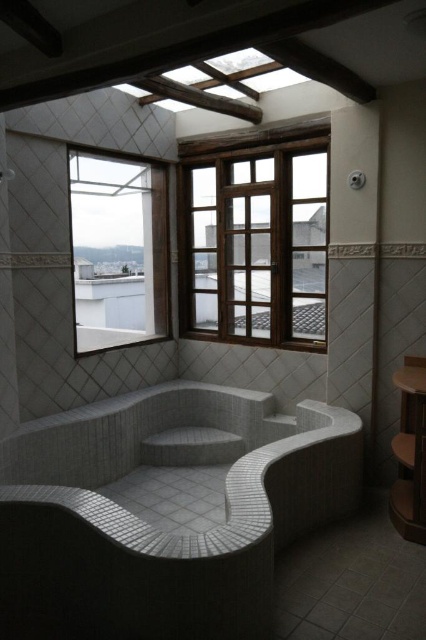
You are standing in the bathroom and want to look out through the clear glass window at upper left. Which direction should you turn from the white mosaic tile jacuzzi at lower center to face the window?

Since the white mosaic tile jacuzzi at lower center is to the right of the clear glass window at upper left, you should turn left to face the window.